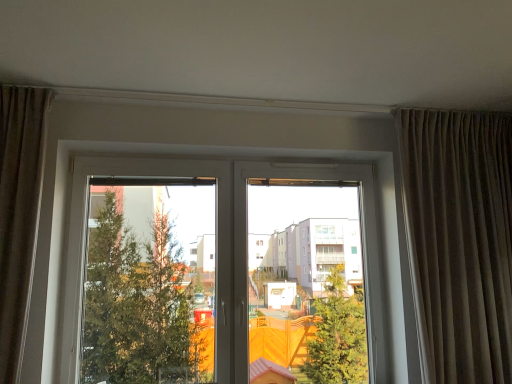
Image resolution: width=512 pixels, height=384 pixels. What do you see at coordinates (460, 241) in the screenshot?
I see `brown textured curtain at right` at bounding box center [460, 241].

In order to click on brown textured curtain at right in this screenshot , I will do `click(460, 241)`.

Locate an element on the screen. This screenshot has height=384, width=512. transparent glass window at center is located at coordinates (225, 249).

Image resolution: width=512 pixels, height=384 pixels. What do you see at coordinates (225, 249) in the screenshot?
I see `transparent glass window at center` at bounding box center [225, 249].

At what (x,y) coordinates should I click in order to perform the action: click on brown textured curtain at right. Please return your answer as a coordinate pair (x, y). Image resolution: width=512 pixels, height=384 pixels. Looking at the image, I should click on (460, 241).

Between brown textured curtain at right and transparent glass window at center, which one appears on the right side from the viewer's perspective?

brown textured curtain at right.

In the scene shown: Which object is further away from the camera taking this photo, brown textured curtain at right or transparent glass window at center?

transparent glass window at center is behind.

Considering the positions of point (426, 279) and point (372, 304), is point (426, 279) closer or farther from the camera than point (372, 304)?

Point (426, 279) is positioned closer to the camera compared to point (372, 304).

From the image's perspective, which one is positioned higher, brown textured curtain at right or transparent glass window at center?

brown textured curtain at right is shown above in the image.

From a real-world perspective, which object stands above the other?

From a 3D spatial view, brown textured curtain at right is above.

In the scene shown: In terms of width, does brown textured curtain at right look wider or thinner when compared to transparent glass window at center?

In the image, brown textured curtain at right appears to be wider than transparent glass window at center.

Is brown textured curtain at right shorter than transparent glass window at center?

No.

Considering the relative sizes of brown textured curtain at right and transparent glass window at center in the image provided, is brown textured curtain at right smaller than transparent glass window at center?

Yes, brown textured curtain at right is smaller than transparent glass window at center.

Can transparent glass window at center be found inside brown textured curtain at right?

Definitely not — transparent glass window at center is not inside brown textured curtain at right.

Is brown textured curtain at right beside transparent glass window at center?

No, brown textured curtain at right is not beside transparent glass window at center.

From the picture: Does brown textured curtain at right turn towards transparent glass window at center?

No, brown textured curtain at right is not facing towards transparent glass window at center.

How many degrees apart are the facing directions of brown textured curtain at right and transparent glass window at center?

A: The facing directions of brown textured curtain at right and transparent glass window at center are 0.273 degrees apart.

You are a GUI agent. You are given a task and a screenshot of the screen. Output one action in this format:
    pyautogui.click(x=<x>, y=<y>)
    Task: Click on the curtain that appears above the transparent glass window at center (from a real-world perspective)
    Image resolution: width=512 pixels, height=384 pixels.
    Given the screenshot: What is the action you would take?
    pyautogui.click(x=460, y=241)

Based on their positions, is transparent glass window at center located to the left or right of brown textured curtain at right?

Clearly, transparent glass window at center is on the left of brown textured curtain at right in the image.

Relative to brown textured curtain at right, is transparent glass window at center in front or behind?

Clearly, transparent glass window at center is behind brown textured curtain at right.

Which point is more forward, (232, 267) or (498, 305)?

The point (498, 305) is closer.

From the image's perspective, is transparent glass window at center above or below brown textured curtain at right?

transparent glass window at center is below brown textured curtain at right.

From a real-world perspective, relative to brown textured curtain at right, is transparent glass window at center vertically above or below?

Clearly, from a real-world perspective, transparent glass window at center is below brown textured curtain at right.

Which object is thinner, transparent glass window at center or brown textured curtain at right?

With smaller width is transparent glass window at center.

In terms of height, does transparent glass window at center look taller or shorter compared to brown textured curtain at right?

transparent glass window at center is shorter than brown textured curtain at right.

Is transparent glass window at center bigger than brown textured curtain at right?

Yes.

Looking at this image, is transparent glass window at center located outside brown textured curtain at right?

Yes, transparent glass window at center is outside of brown textured curtain at right.

Is transparent glass window at center positioned far away from brown textured curtain at right?

No, transparent glass window at center is not far from brown textured curtain at right.

Is brown textured curtain at right at the back of transparent glass window at center?

transparent glass window at center does not have its back to brown textured curtain at right.

How many degrees apart are the facing directions of transparent glass window at center and brown textured curtain at right?

There is a 0.273-degree angle between the facing directions of transparent glass window at center and brown textured curtain at right.

Image resolution: width=512 pixels, height=384 pixels. I want to click on window behind the brown textured curtain at right, so click(x=225, y=249).

At what (x,y) coordinates should I click in order to perform the action: click on window beneath the brown textured curtain at right (from a real-world perspective). Please return your answer as a coordinate pair (x, y). Looking at the image, I should click on (225, 249).

You are a GUI agent. You are given a task and a screenshot of the screen. Output one action in this format:
    pyautogui.click(x=<x>, y=<y>)
    Task: Click on the curtain in front of the transparent glass window at center
    The height and width of the screenshot is (384, 512).
    Given the screenshot: What is the action you would take?
    pyautogui.click(x=460, y=241)